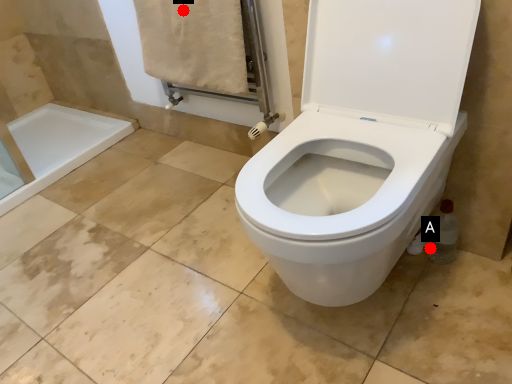
Question: Two points are circled on the image, labeled by A and B beside each circle. Which point is closer to the camera taking this photo?

Choices:
 (A) A is closer
 (B) B is closer

Answer: (A)